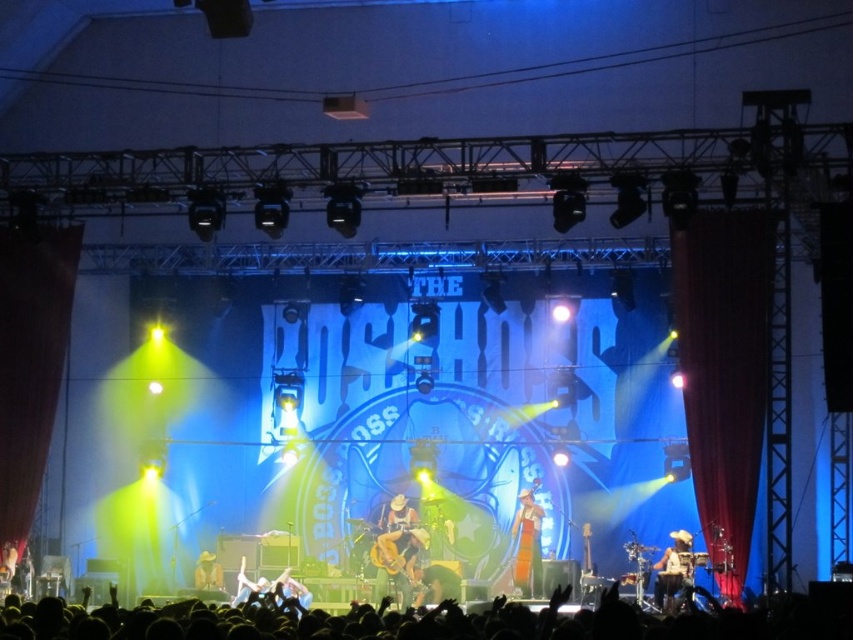
You are a photographer at the concert and want to capture a photo of both the wooden acoustic guitar at center and the shiny metallic cowboy hat at center. If you position your camera to the right side of the stage, which object will appear on the left side of the photo?

The wooden acoustic guitar at center will appear on the left side of the photo because it is positioned to the left of the shiny metallic cowboy hat at center, so when viewed from the right side of the stage, the guitar would be on the left in the frame.

Based on the photo, you are a photographer at the concert and need to capture a closeup shot of both the wooden acoustic guitar at center and the shiny metallic cowboy hat at center. Since your camera can only focus on one object at a time, which object should you choose to ensure it appears larger in the photo?

The shiny metallic cowboy hat at center is larger than the wooden acoustic guitar at center, so to capture a larger image, focus on the shiny metallic cowboy hat at center.